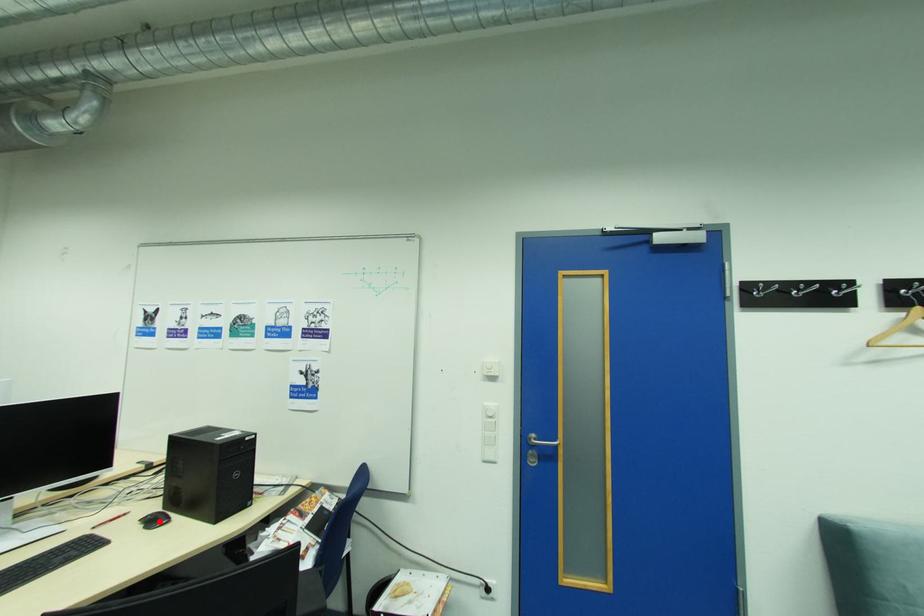
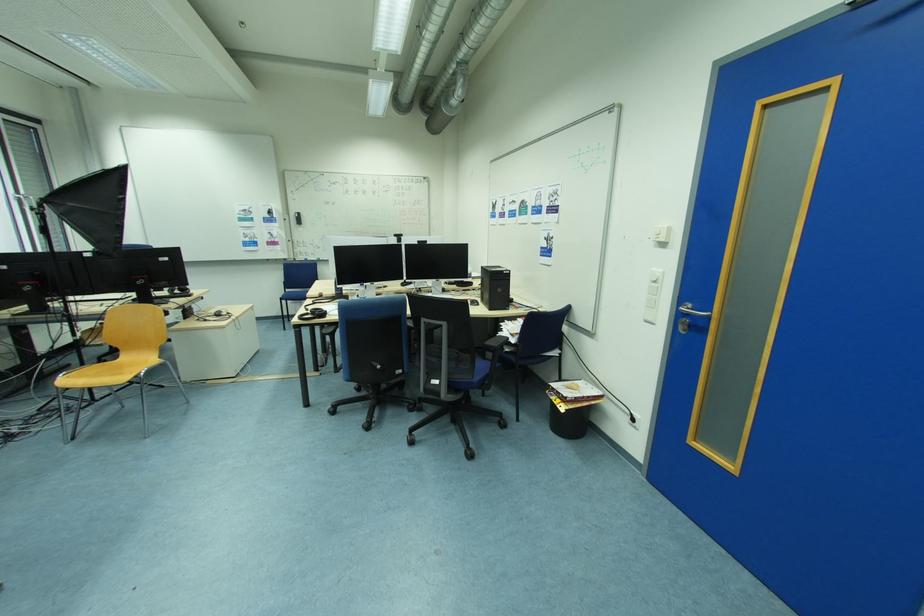
Where in the second image is the point corresponding to the highlighted location from the first image?

(480, 304)